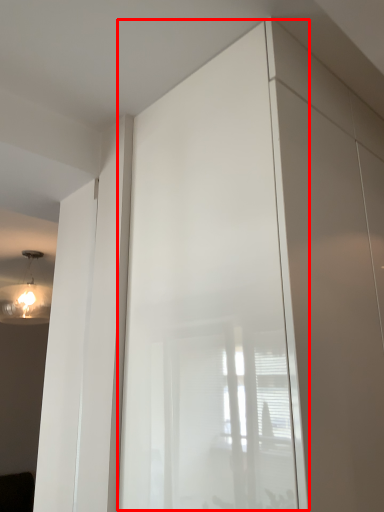
Question: In this image, where is screen door (annotated by the red box) located relative to light fixture?

Choices:
 (A) left
 (B) right

Answer: (B)